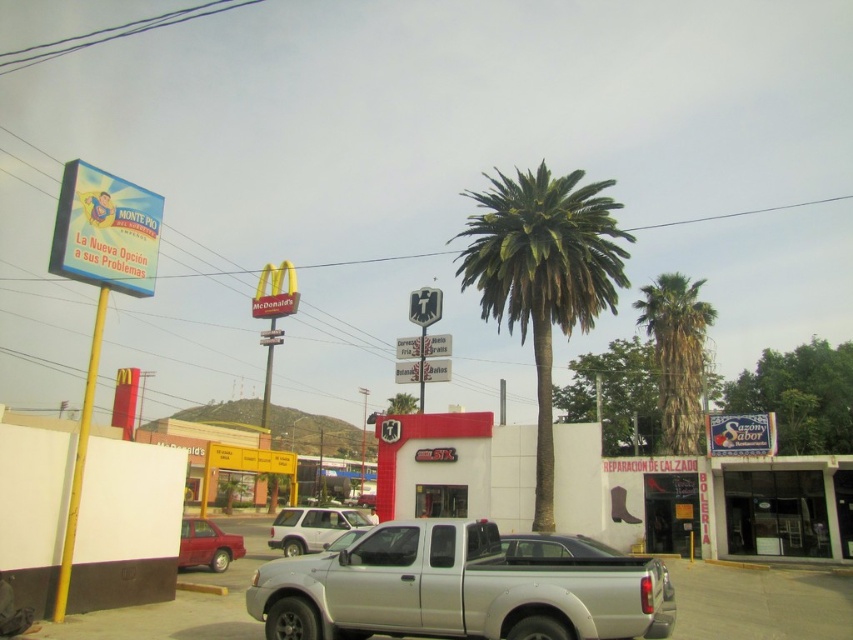
You are standing at the point labeled point (543, 275) in the image. What is the nearest object to you?

The nearest object to you is the green leafy palm tree at center, as the point (543, 275) is located on it.

You are a delivery person standing at the metallic red sedan at lower left. You need to deliver a package to the McDonalds restaurant. The path to McDonalds is clear except for the green leafy palm tree at center. Can you safely navigate around the palm tree to reach McDonalds without hitting the tree?

The green leafy palm tree at center is 26.73 meters away from the metallic red sedan at lower left. Since the distance is sufficient, you can safely navigate around the palm tree to reach McDonalds without hitting the tree.

You are a delivery driver who needs to park your vehicle between the green leafy palm tree at center and the metallic red sedan at lower left. Is this possible given their current positions?

The green leafy palm tree at center is positioned on the right side of the metallic red sedan at lower left, meaning there is no space between them for parking. Therefore, it is not possible to park between them.